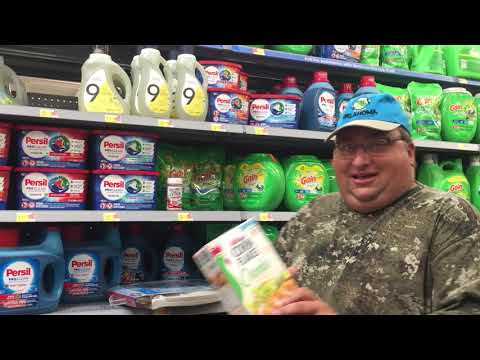
Locate an element on the screen. shelf is located at coordinates (98, 327), (150, 236), (165, 129), (320, 65).